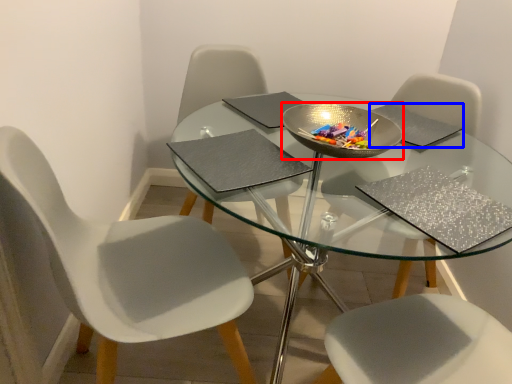
Question: Which object appears farthest to the camera in this image, bowl (highlighted by a red box) or pad (highlighted by a blue box)?

Choices:
 (A) bowl
 (B) pad

Answer: (B)